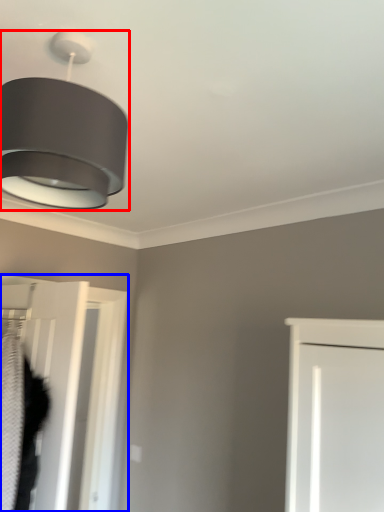
Question: Among these objects, which one is farthest to the camera, lamp (highlighted by a red box) or door (highlighted by a blue box)?

Choices:
 (A) lamp
 (B) door

Answer: (B)